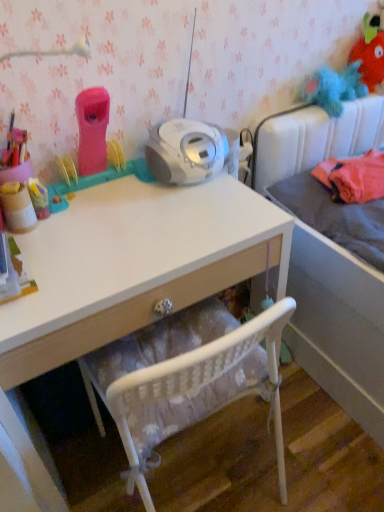
Question: Is gray fabric bed at upper right inside or outside of gray fabric mattress at right?

Choices:
 (A) inside
 (B) outside

Answer: (B)

Question: Does point tap(367, 373) appear closer or farther from the camera than point tap(286, 189)?

Choices:
 (A) farther
 (B) closer

Answer: (B)

Question: Estimate the real-world distances between objects in this image. Which object is farther from the matte brown jar at left, which is counted as the third toy, starting from the right?

Choices:
 (A) blue plush toy at upper right, acting as the second toy starting from the back
 (B) gray fabric mattress at right
 (C) gray fabric bed at upper right
 (D) white glossy desk at center
 (E) fluffy plush toy at upper right, placed as the first toy when sorted from back to front

Answer: (E)

Question: Which of these objects is positioned closest to the matte brown jar at left, placed as the third toy when sorted from top to bottom?

Choices:
 (A) white glossy desk at center
 (B) gray fabric mattress at right
 (C) blue plush toy at upper right, the 2th toy when ordered from left to right
 (D) gray fabric bed at upper right
 (E) fluffy plush toy at upper right, placed as the first toy when sorted from back to front

Answer: (A)